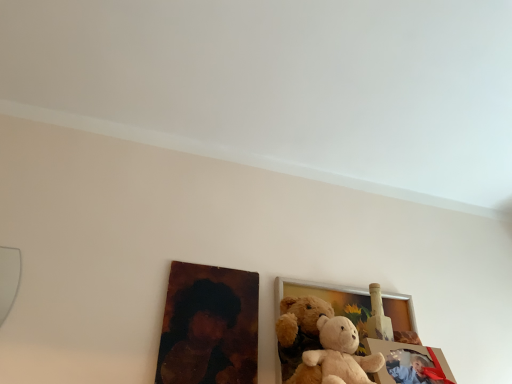
Question: From a real-world perspective, is wooden photo frame at center, which appears as the 2th picture frame when viewed from the front, physically below oil painting portrait at lower left?

Choices:
 (A) yes
 (B) no

Answer: (A)

Question: Is wooden photo frame at center, which appears as the 2th picture frame when viewed from the front, at the left side of oil painting portrait at lower left?

Choices:
 (A) yes
 (B) no

Answer: (B)

Question: Considering the relative sizes of wooden photo frame at center, positioned as the 1th picture frame in back-to-front order, and oil painting portrait at lower left in the image provided, is wooden photo frame at center, positioned as the 1th picture frame in back-to-front order, thinner than oil painting portrait at lower left?

Choices:
 (A) yes
 (B) no

Answer: (B)

Question: Can you confirm if wooden photo frame at center, positioned as the 1th picture frame in back-to-front order, is bigger than oil painting portrait at lower left?

Choices:
 (A) no
 (B) yes

Answer: (B)

Question: Is wooden photo frame at center, which appears as the 2th picture frame when viewed from the front, completely or partially outside of oil painting portrait at lower left?

Choices:
 (A) yes
 (B) no

Answer: (A)

Question: Is wooden photo frame at center, positioned as the 1th picture frame in back-to-front order, at the right side of oil painting portrait at lower left?

Choices:
 (A) no
 (B) yes

Answer: (B)

Question: Considering the relative sizes of wooden photo frame at center, which appears as the 2th picture frame when viewed from the front, and matte plastic picture frame at lower right, acting as the 2th picture frame starting from the back, in the image provided, is wooden photo frame at center, which appears as the 2th picture frame when viewed from the front, bigger than matte plastic picture frame at lower right, acting as the 2th picture frame starting from the back,?

Choices:
 (A) yes
 (B) no

Answer: (A)

Question: From a real-world perspective, is wooden photo frame at center, which appears as the 2th picture frame when viewed from the front, under matte plastic picture frame at lower right, placed as the 1th picture frame when sorted from front to back?

Choices:
 (A) no
 (B) yes

Answer: (A)

Question: Is wooden photo frame at center, which appears as the 2th picture frame when viewed from the front, wider than matte plastic picture frame at lower right, acting as the 2th picture frame starting from the back?

Choices:
 (A) yes
 (B) no

Answer: (B)

Question: Is wooden photo frame at center, which appears as the 2th picture frame when viewed from the front, with matte plastic picture frame at lower right, acting as the 2th picture frame starting from the back?

Choices:
 (A) yes
 (B) no

Answer: (B)

Question: Is wooden photo frame at center, which appears as the 2th picture frame when viewed from the front, at the right side of matte plastic picture frame at lower right, placed as the 1th picture frame when sorted from front to back?

Choices:
 (A) no
 (B) yes

Answer: (A)

Question: Is wooden photo frame at center, which appears as the 2th picture frame when viewed from the front, positioned before matte plastic picture frame at lower right, acting as the 2th picture frame starting from the back?

Choices:
 (A) no
 (B) yes

Answer: (A)

Question: From the image's perspective, does matte plastic picture frame at lower right, acting as the 2th picture frame starting from the back, appear lower than oil painting portrait at lower left?

Choices:
 (A) no
 (B) yes

Answer: (B)